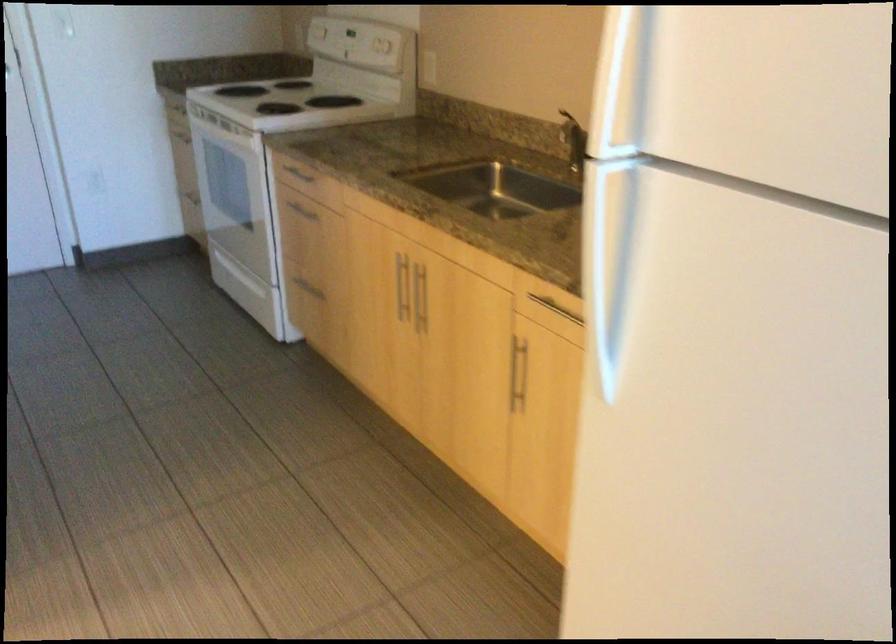
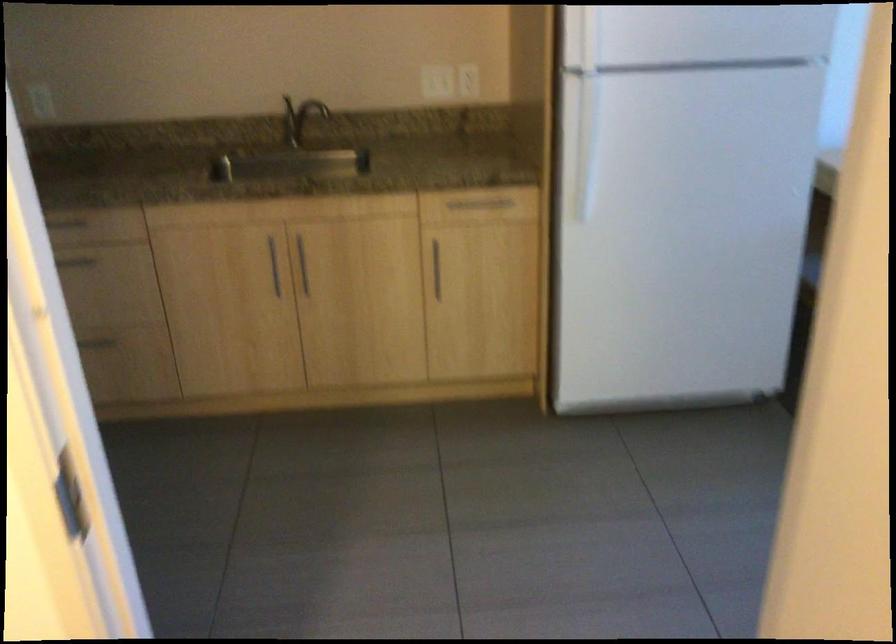
Where in the second image is the point corresponding to (421,295) from the first image?

(303, 265)